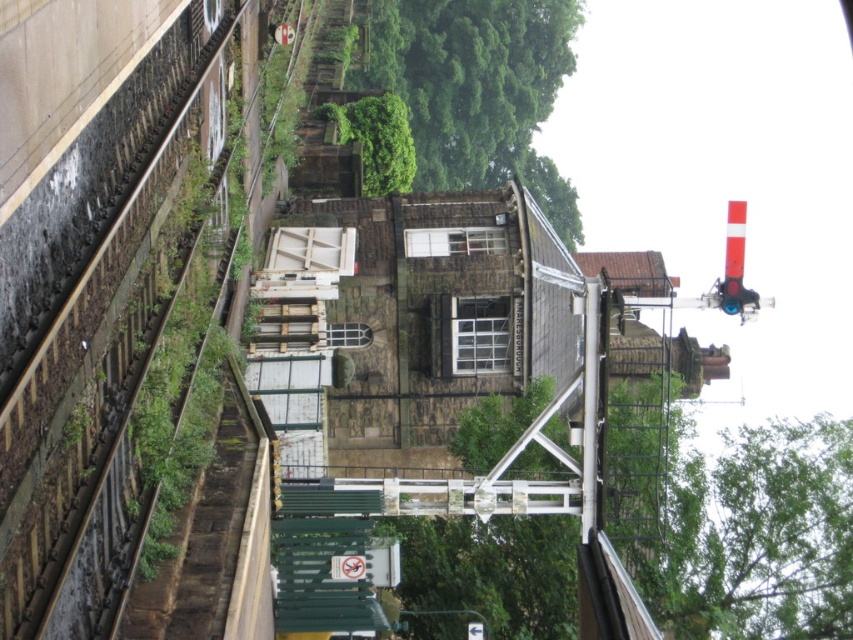
You are a railway engineer assessing the scene. Which object, the brown stone train track at left or the green leafy tree at upper center, occupies more visual space in the image?

The green leafy tree at upper center occupies more visual space than the brown stone train track at left because the brown stone train track at left is smaller than the green leafy tree at upper center.

You are standing at the railway station and see the green leafy tree at upper center and the green leafy tree at center. Which tree is closer to you?

The green leafy tree at upper center is closer to you because it is positioned further to the viewer than the green leafy tree at center.

You are a passenger waiting at the railway station. You notice a brown stone train track at left and a green leafy tree at upper center. Which object is closer to the ground?

The brown stone train track at left is positioned under the green leafy tree at upper center, so it is closer to the ground.